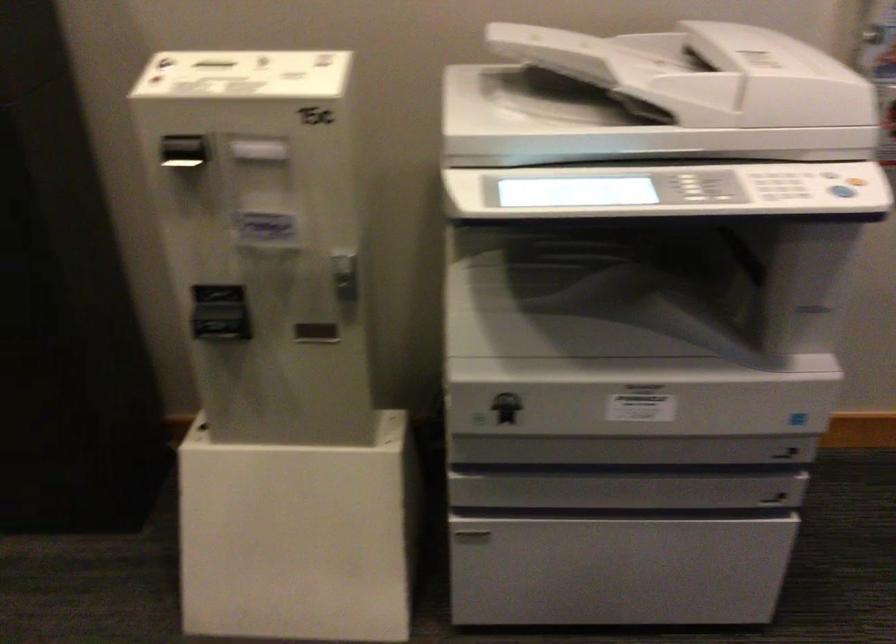
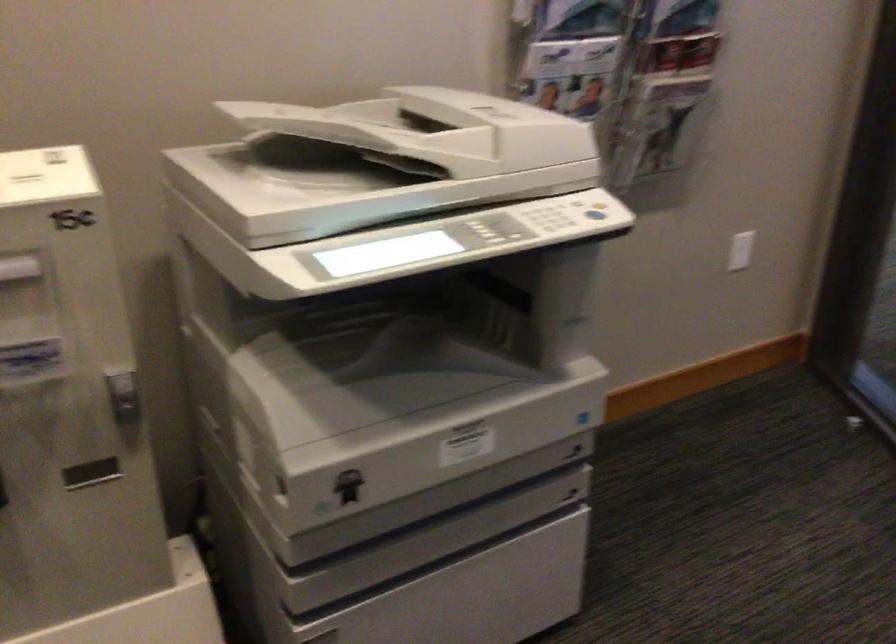
Question: Based on the continuous images, in which direction is the camera rotating? Reply with the corresponding letter.

Choices:
 (A) Left
 (B) Right
 (C) Up
 (D) Down

Answer: (B)